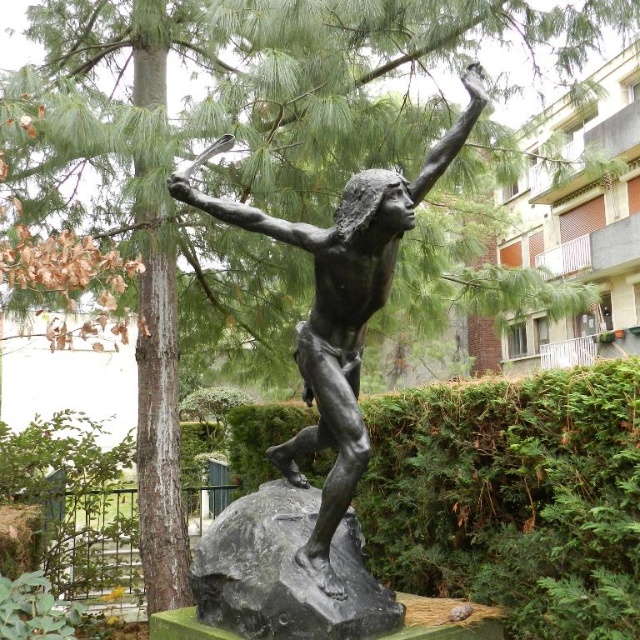
You are a landscape architect designing a garden pathway that needs to accommodate both visitors and a maintenance vehicle. The bronze statue at center and the black polished stone at center are key elements. Considering their heights, which object might pose a challenge for the vehicle to pass under if placed along the pathway?

The bronze statue at center has a greater height compared to the black polished stone at center, so it might pose a challenge for the maintenance vehicle to pass under if placed along the pathway.

You are an art student observing the bronze statue at center and the black polished stone at center in the park. If you want to take a photo that includes both objects, which one should you focus on first to ensure both are in sharp focus?

The bronze statue at center is closer to the viewer than the black polished stone at center, so you should focus on the bronze statue at center first to ensure both are in sharp focus.

You are a park visitor who wants to take a photo of the bronze statue at center without including the black polished stone at center in the background. Is it possible to do so based on their positions?

The bronze statue at center is located above the black polished stone at center, so you can angle your camera downward to capture the statue while avoiding the stone base in the background.